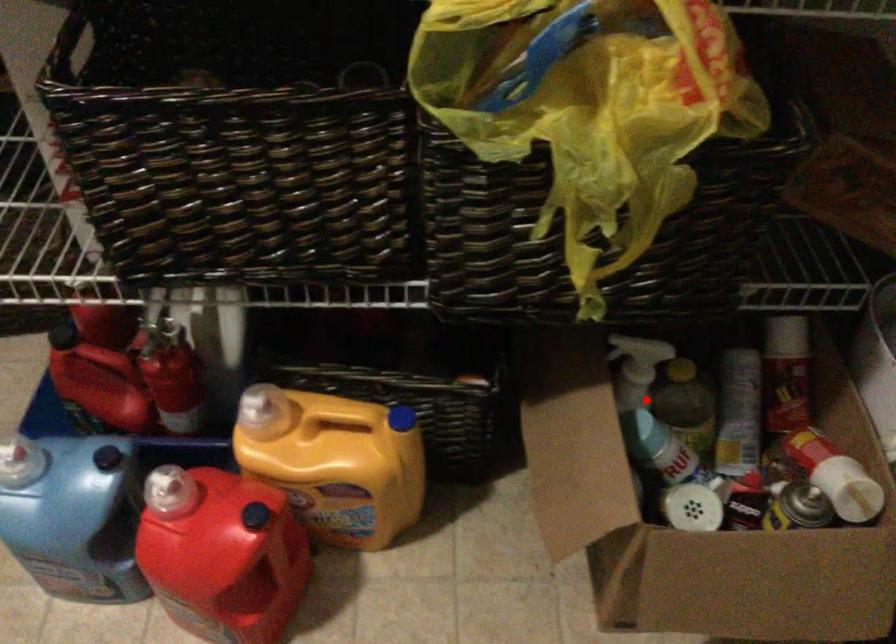
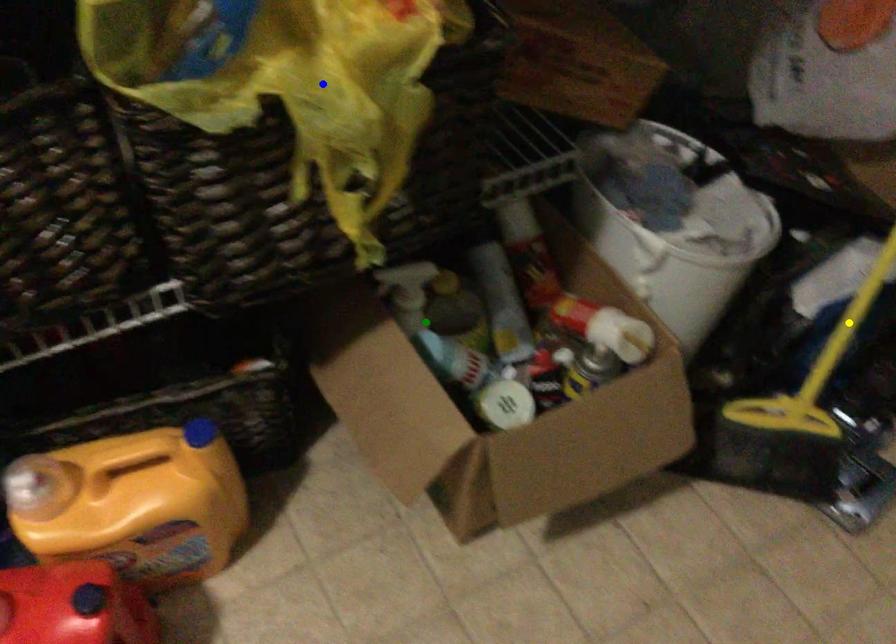
Question: I am providing you with two images of the same scene from different viewpoints. A red point is marked on the first image. You are given multiple points on the second image. Can you choose the point in image 2 that corresponds to the point in image 1?

Choices:
 (A) blue point
 (B) green point
 (C) yellow point

Answer: (B)